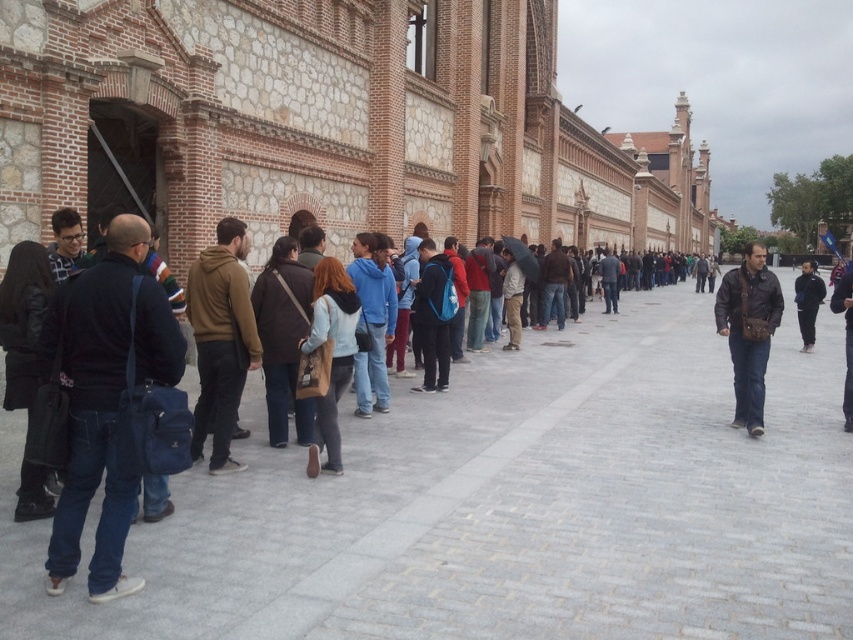
Where is `brown leather jacket at right`? brown leather jacket at right is located at coordinates (747, 330).

Does brown leather jacket at right appear over dark blue jacket at center?

No, brown leather jacket at right is not above dark blue jacket at center.

Does point (749, 312) lie behind point (808, 323)?

No.

I want to click on brown leather jacket at right, so pos(747,330).

Does dark blue jeans at center have a smaller size compared to dark blue fabric jacket at left?

No, dark blue jeans at center is not smaller than dark blue fabric jacket at left.

Is dark blue jeans at center in front of dark blue fabric jacket at left?

That is True.

The width and height of the screenshot is (853, 640). Describe the element at coordinates (125, 378) in the screenshot. I see `dark blue jeans at center` at that location.

I want to click on dark blue jeans at center, so click(125, 378).

Who is positioned more to the right, brown suede jacket at center or black leather jacket at center?

black leather jacket at center

Is point (242, 296) farther from viewer compared to point (851, 428)?

No.

Identify the location of brown suede jacket at center. This screenshot has height=640, width=853. (219, 340).